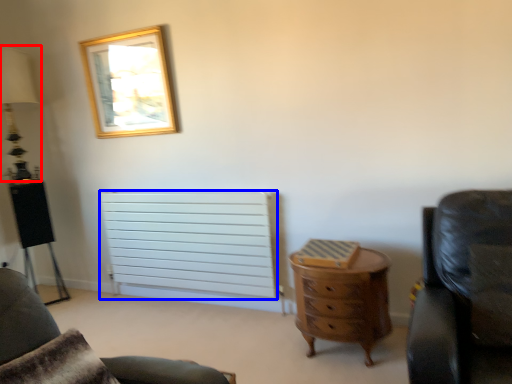
Question: Which of the following is the farthest to the observer, table lamp (highlighted by a red box) or radiator (highlighted by a blue box)?

Choices:
 (A) table lamp
 (B) radiator

Answer: (A)